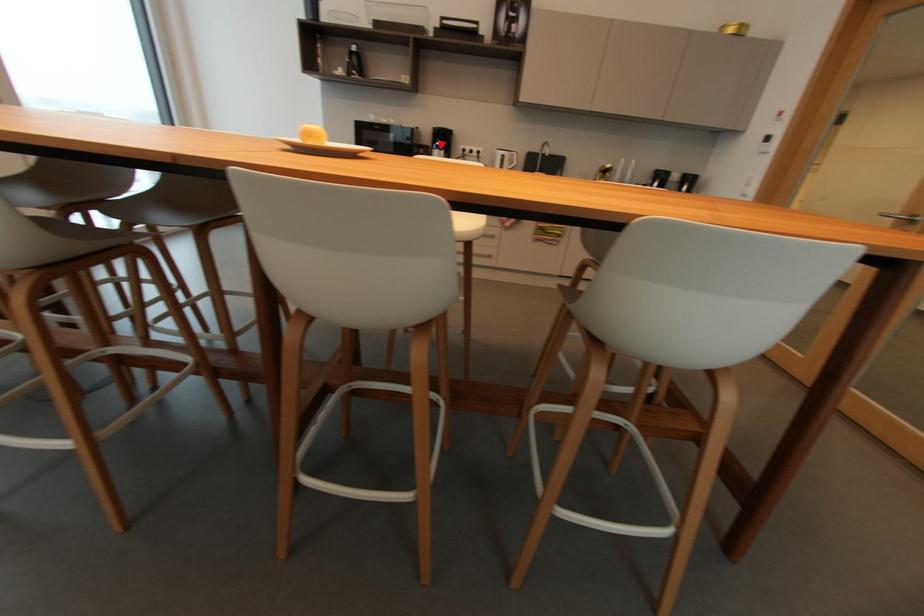
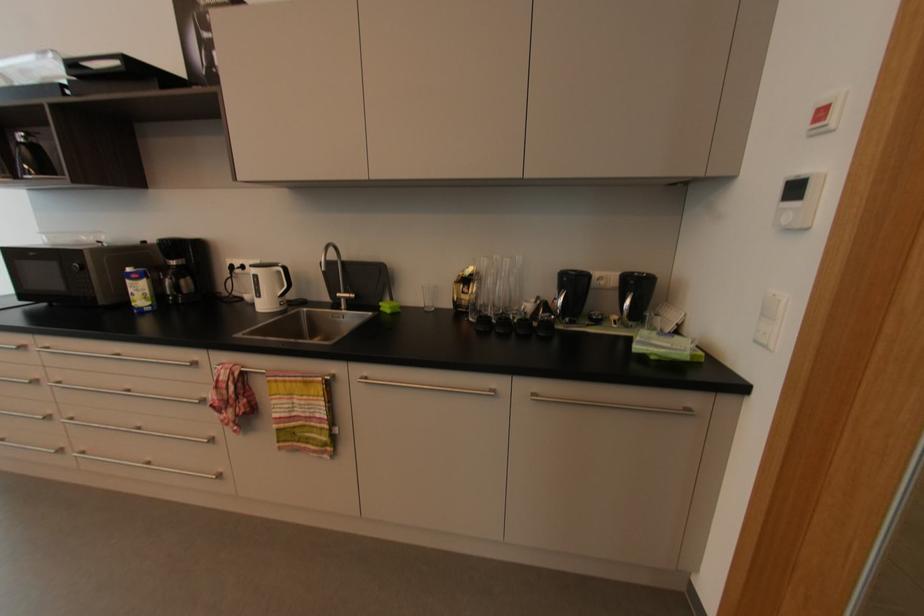
Question: I am providing you with two images of the same scene from different viewpoints. A red point is shown in image1. For the corresponding object point in image2, is it positioned nearer or farther from the camera?

Choices:
 (A) Nearer
 (B) Farther

Answer: (B)